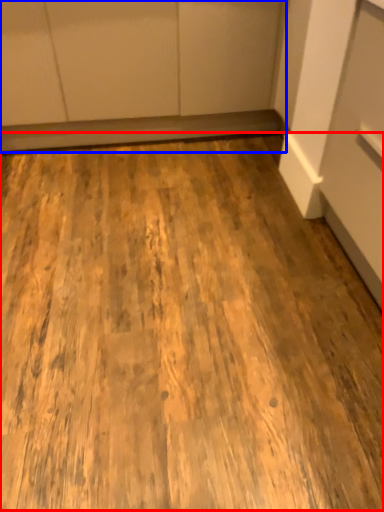
Question: Which object is closer to the camera taking this photo, plywood (highlighted by a red box) or cabinetry (highlighted by a blue box)?

Choices:
 (A) plywood
 (B) cabinetry

Answer: (A)